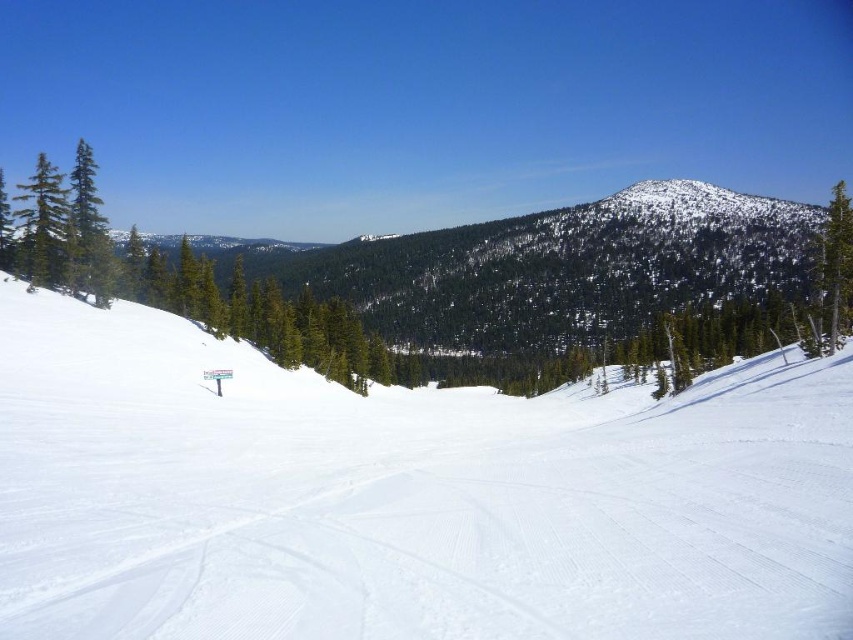
Which is more to the left, white smooth snow at center or green textured pine at center?

Positioned to the left is white smooth snow at center.

Who is positioned more to the right, white smooth snow at center or green textured pine at center?

From the viewer's perspective, green textured pine at center appears more on the right side.

Which is in front, point (698, 385) or point (599, 253)?

Positioned in front is point (698, 385).

This screenshot has height=640, width=853. I want to click on white smooth snow at center, so click(405, 497).

Does white smooth snow at center appear under green matte tree at right?

Indeed, white smooth snow at center is positioned under green matte tree at right.

Between white smooth snow at center and green matte tree at right, which one appears on the right side from the viewer's perspective?

green matte tree at right

Does point (80, 428) come in front of point (834, 324)?

Yes, it is.

You are a GUI agent. You are given a task and a screenshot of the screen. Output one action in this format:
    pyautogui.click(x=<x>, y=<y>)
    Task: Click on the white smooth snow at center
    This screenshot has height=640, width=853.
    Given the screenshot: What is the action you would take?
    pyautogui.click(x=405, y=497)

Does green textured pine at center appear over green matte tree at left?

Yes, green textured pine at center is above green matte tree at left.

Which of these two, green textured pine at center or green matte tree at left, stands shorter?

With less height is green matte tree at left.

Who is more distant from viewer, (405, 259) or (45, 166)?

Positioned behind is point (405, 259).

Locate an element on the screen. This screenshot has height=640, width=853. green textured pine at center is located at coordinates (508, 289).